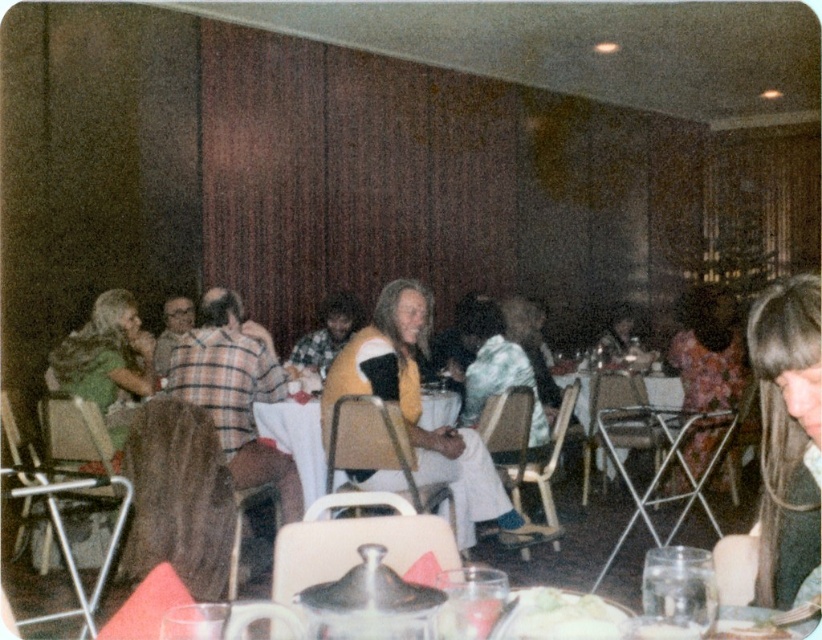
Question: Is yellow sweater at center to the right of translucent glass plate at center from the viewer's perspective?

Choices:
 (A) no
 (B) yes

Answer: (A)

Question: Can you confirm if white creamy food at lower center is positioned above translucent glass bowl at center?

Choices:
 (A) yes
 (B) no

Answer: (B)

Question: Is floral dress at center wider than translucent glass bowl at center?

Choices:
 (A) no
 (B) yes

Answer: (B)

Question: Which of the following is the farthest from the observer?

Choices:
 (A) white plastic table at center
 (B) white creamy food at lower center
 (C) wooden table at center

Answer: (A)

Question: Which point is farther from the camera taking this photo?

Choices:
 (A) (525, 625)
 (B) (677, 406)
 (C) (432, 410)

Answer: (B)

Question: Which object is the closest to the translucent glass plate at center?

Choices:
 (A) wooden table at center
 (B) white creamy food at lower center

Answer: (B)